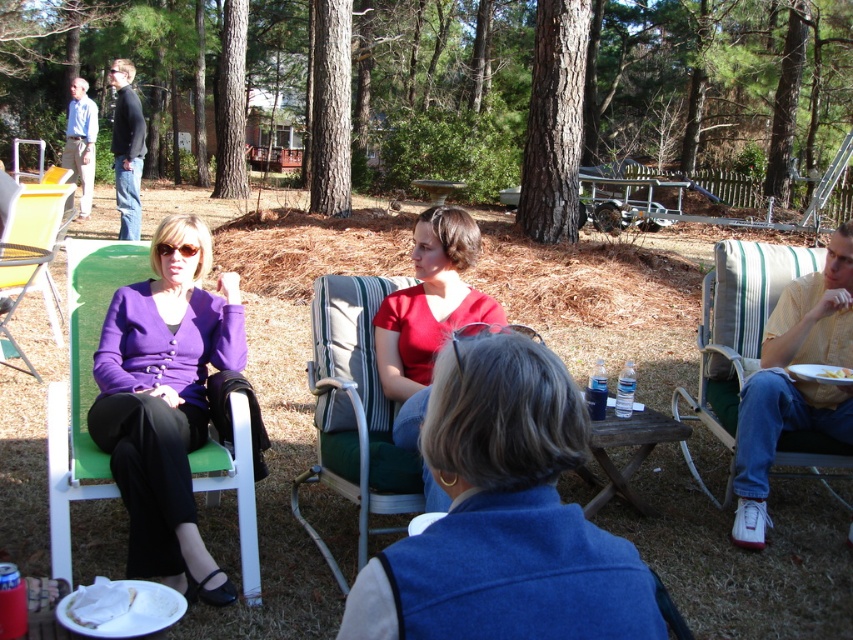
From the picture: Which of these two, green striped fabric chair at right or yellow matte plate at lower right, stands taller?

green striped fabric chair at right is taller.

Does green striped fabric chair at right appear under yellow matte plate at lower right?

Yes.

Measure the distance between point (727, 381) and camera.

Point (727, 381) and camera are 12.41 feet apart.

The height and width of the screenshot is (640, 853). I want to click on green striped fabric chair at right, so click(735, 333).

Who is positioned more to the right, green fabric chair at center or brown wooden picnic table at center?

brown wooden picnic table at center is more to the right.

How far apart are green fabric chair at center and brown wooden picnic table at center?

3.41 feet

Is point (374, 422) positioned behind point (611, 440)?

No, it is not.

Locate an element on the screen. green fabric chair at center is located at coordinates (354, 412).

Looking at this image, does purple matte sweater at left come behind matte plastic chair at left?

That is False.

This screenshot has height=640, width=853. Describe the element at coordinates (165, 401) in the screenshot. I see `purple matte sweater at left` at that location.

The width and height of the screenshot is (853, 640). Identify the location of purple matte sweater at left. (165, 401).